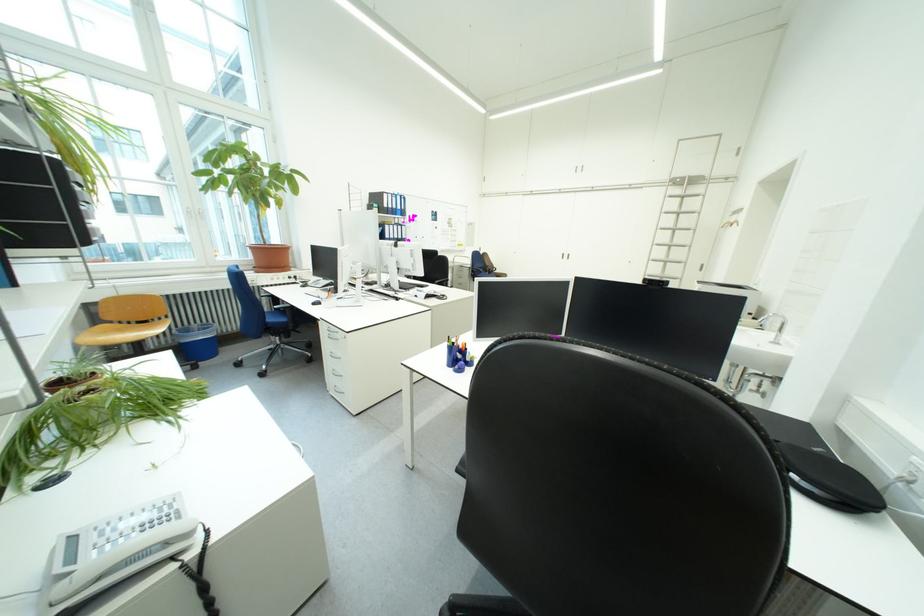
Where would you push the faucet handle? Please return your answer as a coordinate pair (x, y).

(783, 328)